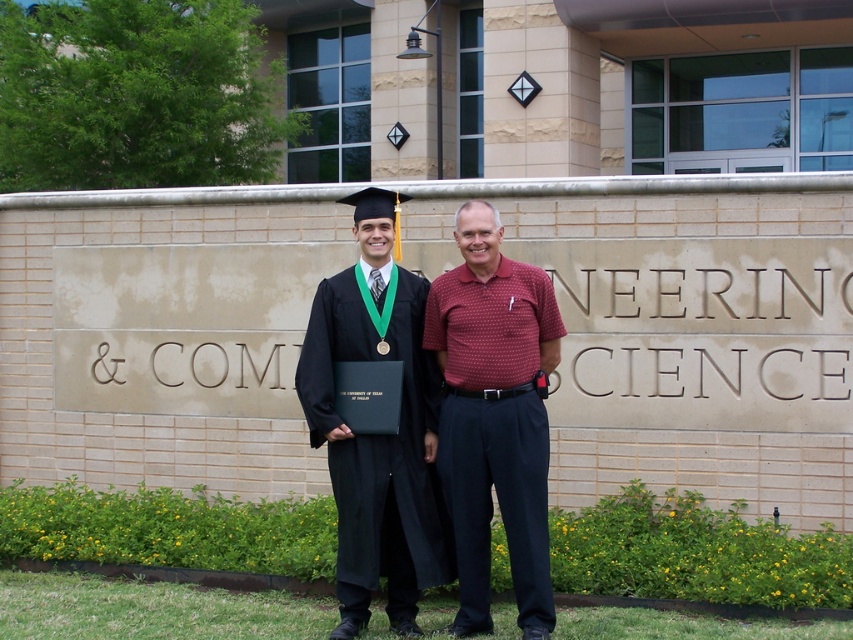
You are standing at the origin point of the coordinate system in the image. The image has a coordinate system where the bottom left corner is the origin. You want to walk to the matte black graduation gown at center. Which direction should you go?

The matte black graduation gown at center is located at coordinate point 0.661 on the x axis and 0.443 on the y axis. Since the origin is at the bottom left corner, you should move to the right along the x axis and upwards along the y axis to reach it.